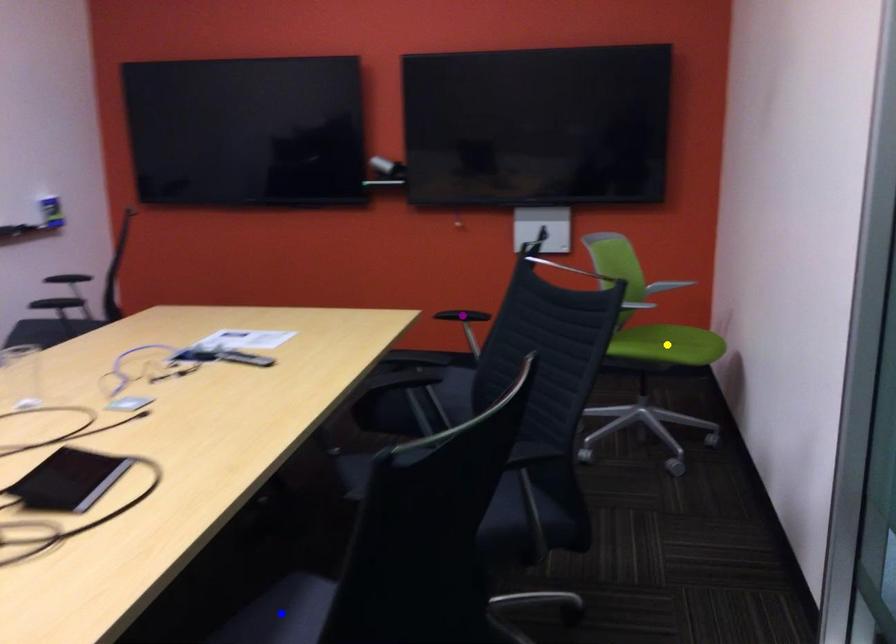
Order these from nearest to farthest:
purple point, blue point, yellow point

1. purple point
2. yellow point
3. blue point